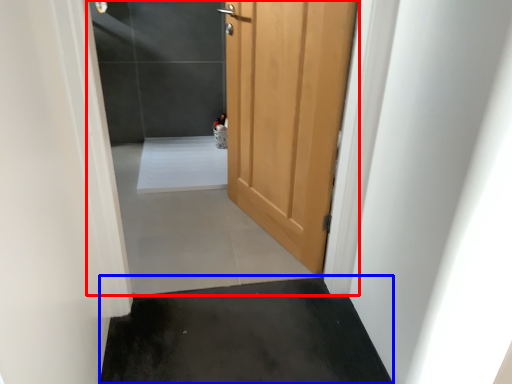
Question: Which of the following is the farthest to the observer, screen door (highlighted by a red box) or concrete (highlighted by a blue box)?

Choices:
 (A) screen door
 (B) concrete

Answer: (B)